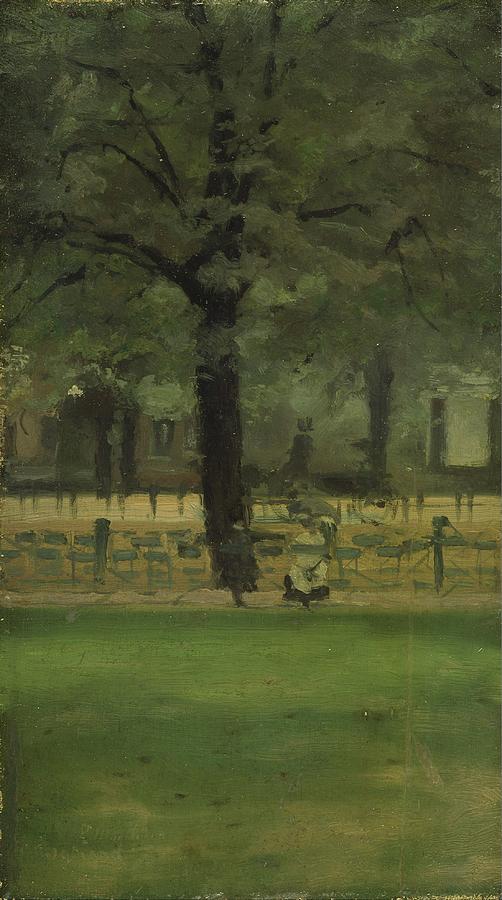
Find the location of a particular element. Image resolution: width=502 pixels, height=900 pixels. chairs is located at coordinates (52, 529), (164, 553), (156, 536), (33, 554), (393, 543), (420, 535), (350, 553), (366, 536), (129, 545).